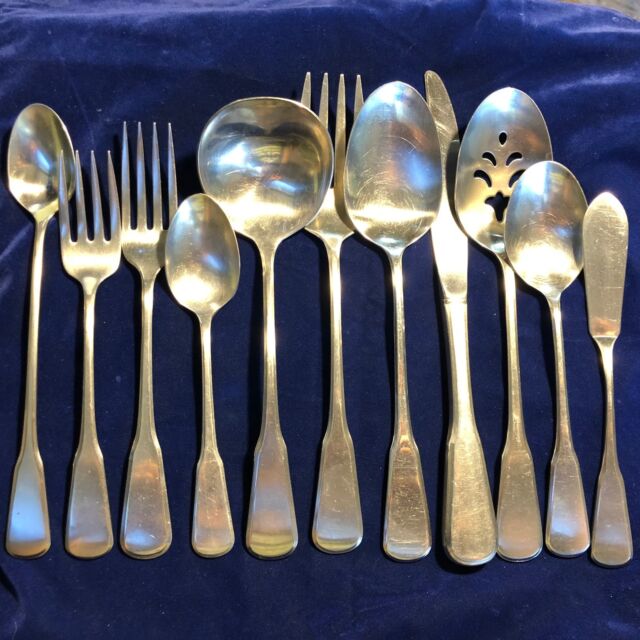
This screenshot has width=640, height=640. Identify the location of spoons. (26, 154), (184, 243), (406, 198), (552, 225), (250, 198).